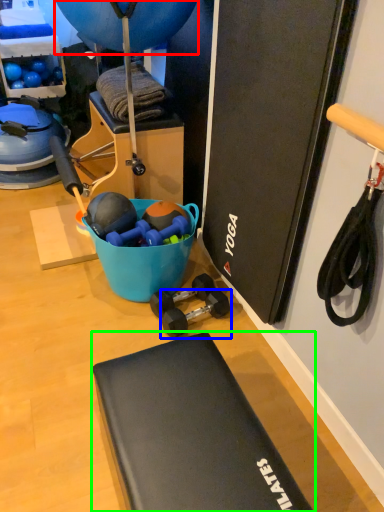
Question: Based on their relative distances, which object is nearer to balloon (highlighted by a red box)? Choose from dumbbell (highlighted by a blue box) and furniture (highlighted by a green box).

Choices:
 (A) dumbbell
 (B) furniture

Answer: (A)